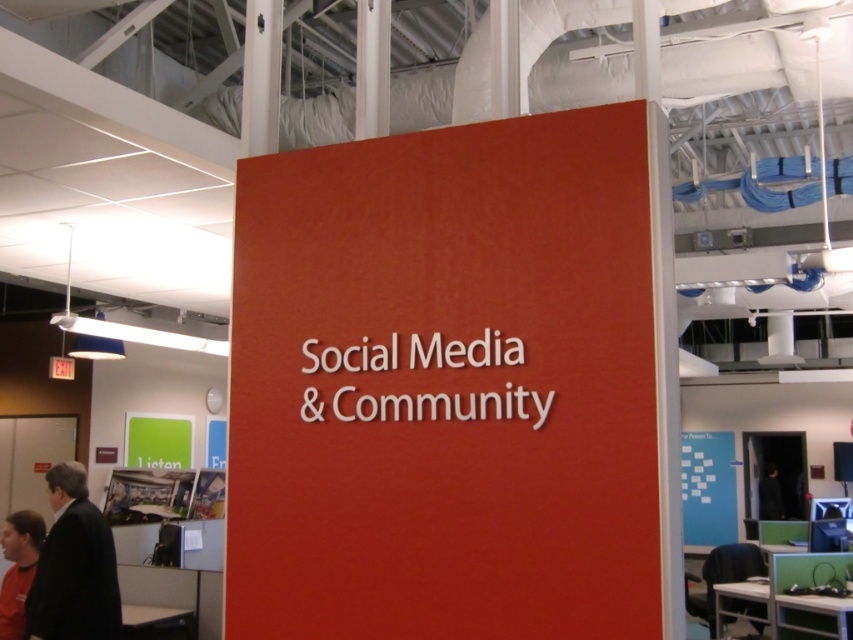
You are an office designer who wants to hang a new decorative item between the matte red sign at center and the black fabric at center. Based on their positions, where should you place the new item?

The matte red sign at center is located above the black fabric at center, so the new decorative item should be placed between them in the vertical space between the matte red sign at center and the black fabric at center.

You are standing in the office shown in the image. There is a point marked at coordinates (74, 566). What is located at this point?

The point at coordinates (74, 566) indicates the location of the dark suit at lower left.

Based on the scene description, where is the matte red sign at center located in the image?

The matte red sign at center is located at point (445, 385).